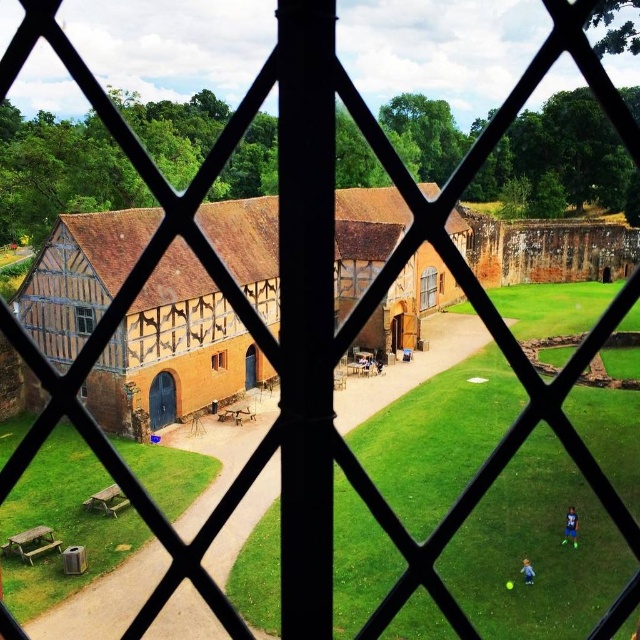
You are an interior designer assessing the view from two windows in a building. You have the matte brown wooden window at center and the wooden lattice window at center. Which window provides a taller opening to view the historic half timbered building?

The matte brown wooden window at center is taller than the wooden lattice window at center, so it provides a taller opening to view the historic half timbered building.

You are standing in a room and looking through the window with a diamond lattice pattern. You notice two points marked on the window glass at coordinates point (419, 284) and point (93, 317). If you want to touch the point that is closer to you, which coordinate should you choose?

Point (93, 317) is closer to you, so you should choose that coordinate.

You are an interior designer assessing the dimensions of two windows in a historic building. You observe a matte brown wooden window at center and a wooden lattice window at center. Which window has a greater width according to the description?

The matte brown wooden window at center might be wider than wooden lattice window at center.